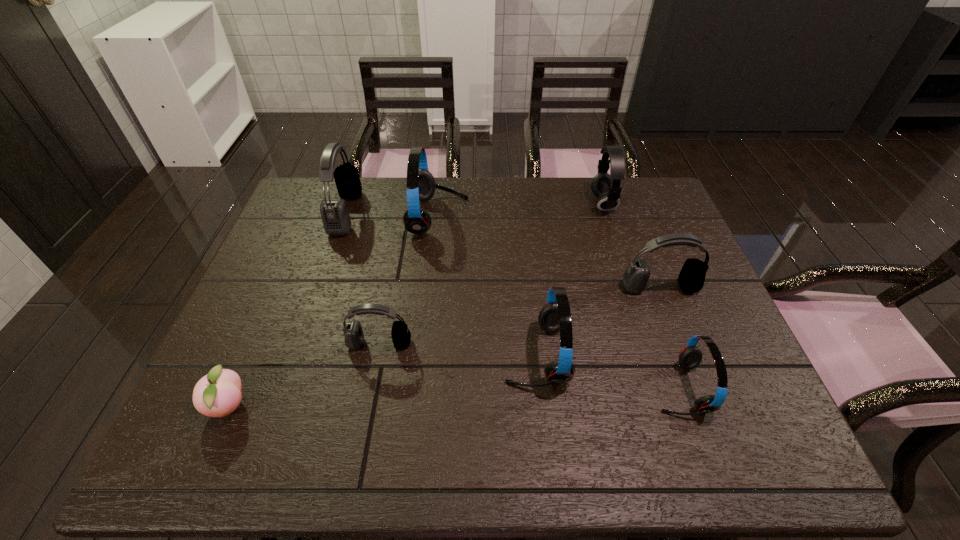
Select which object appears as the seventh closest to the smallest black headset. Please provide its 2D coordinates. Your answer should be formatted as a tuple, i.e. [(x, y)], where the tuple contains the x and y coordinates of a point satisfying the conditions above.

[(606, 187)]

Point out which object is positioned as the sixth nearest to the third farthest headset. Please provide its 2D coordinates. Your answer should be formatted as a tuple, i.e. [(x, y)], where the tuple contains the x and y coordinates of a point satisfying the conditions above.

[(335, 216)]

At what (x,y) coordinates should I click in order to perform the action: click on headset that is the nearest to the leftmost red headset. Please return your answer as a coordinate pair (x, y). The image size is (960, 540). Looking at the image, I should click on (335, 216).

Identify the location of headset identified as the fifth closest to the nearest black headset. (691, 278).

Find the location of a particular element. This screenshot has height=540, width=960. black headset object that ranks as the second closest to the pink peach is located at coordinates (335, 216).

At what (x,y) coordinates should I click in order to perform the action: click on the second closest black headset to the earphone. Please return your answer as a coordinate pair (x, y). Looking at the image, I should click on (354, 336).

Select which red headset appears as the second closest to the rightmost red headset. Please provide its 2D coordinates. Your answer should be formatted as a tuple, i.e. [(x, y)], where the tuple contains the x and y coordinates of a point satisfying the conditions above.

[(421, 186)]

The width and height of the screenshot is (960, 540). Find the location of `red headset that stands as the second closest to the earphone`. red headset that stands as the second closest to the earphone is located at coordinates (555, 315).

This screenshot has height=540, width=960. What are the coordinates of `free space that satisfies the following two spatial constraints: 1. on the headband of the second nearest black headset; 2. with the microphone attached to the side of the smallest red headset` in the screenshot? It's located at (698, 388).

You are a GUI agent. You are given a task and a screenshot of the screen. Output one action in this format:
    pyautogui.click(x=<x>, y=<y>)
    Task: Click on the blank space that satisfies the following two spatial constraints: 1. on the ear cups of the earphone; 2. on the headband of the second black headset from left to right
    
    Given the screenshot: What is the action you would take?
    pyautogui.click(x=648, y=343)